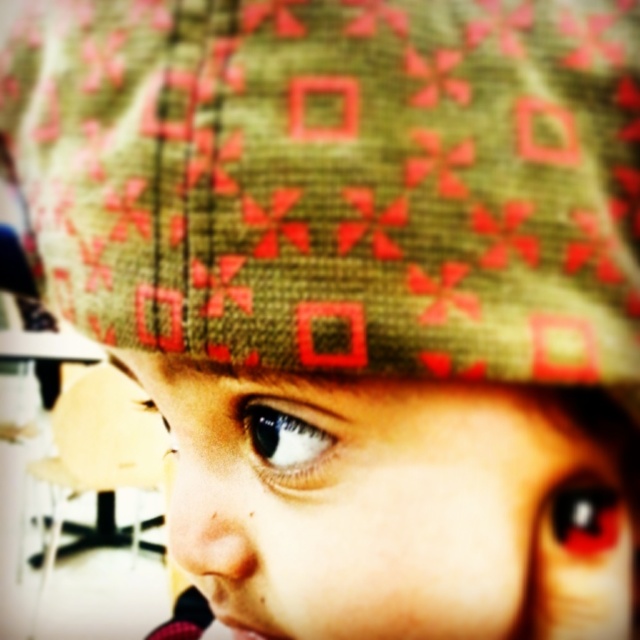
Can you confirm if black glossy eye at center is bigger than shiny blue eye at center?

Actually, black glossy eye at center might be smaller than shiny blue eye at center.

You are a GUI agent. You are given a task and a screenshot of the screen. Output one action in this format:
    pyautogui.click(x=<x>, y=<y>)
    Task: Click on the black glossy eye at center
    This screenshot has width=640, height=640.
    Given the screenshot: What is the action you would take?
    pyautogui.click(x=584, y=515)

This screenshot has height=640, width=640. I want to click on black glossy eye at center, so [584, 515].